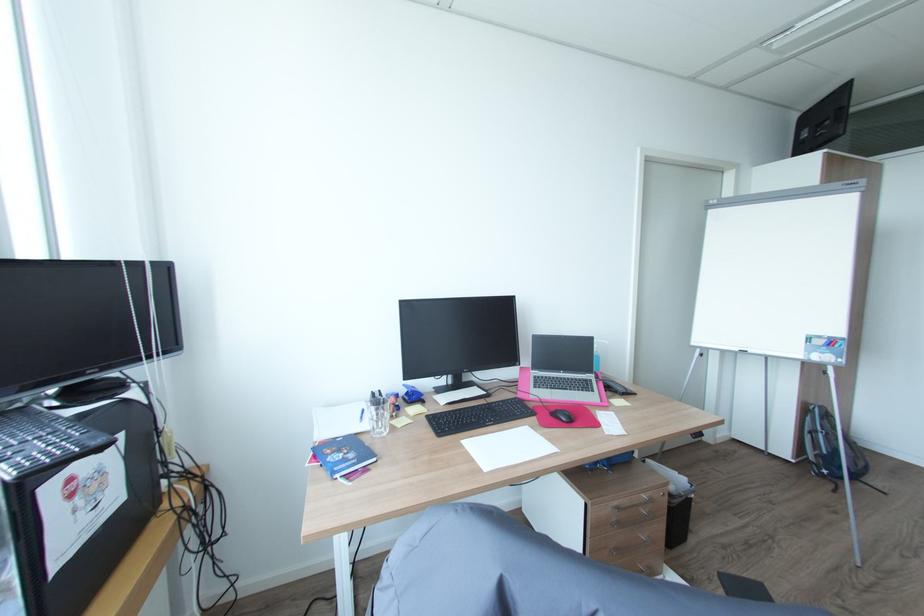
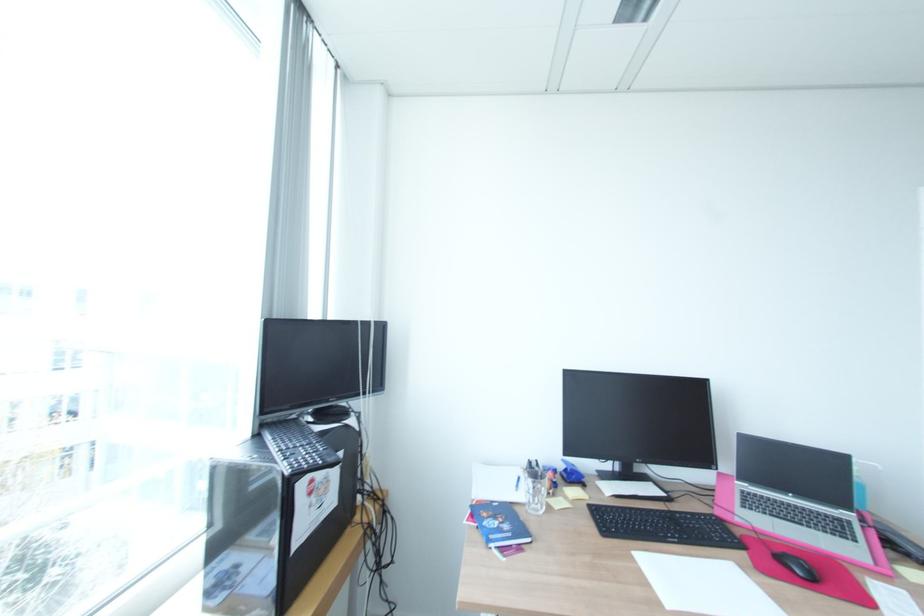
The point at (553, 387) is marked in the first image. Where is the corresponding point in the second image?

(770, 513)